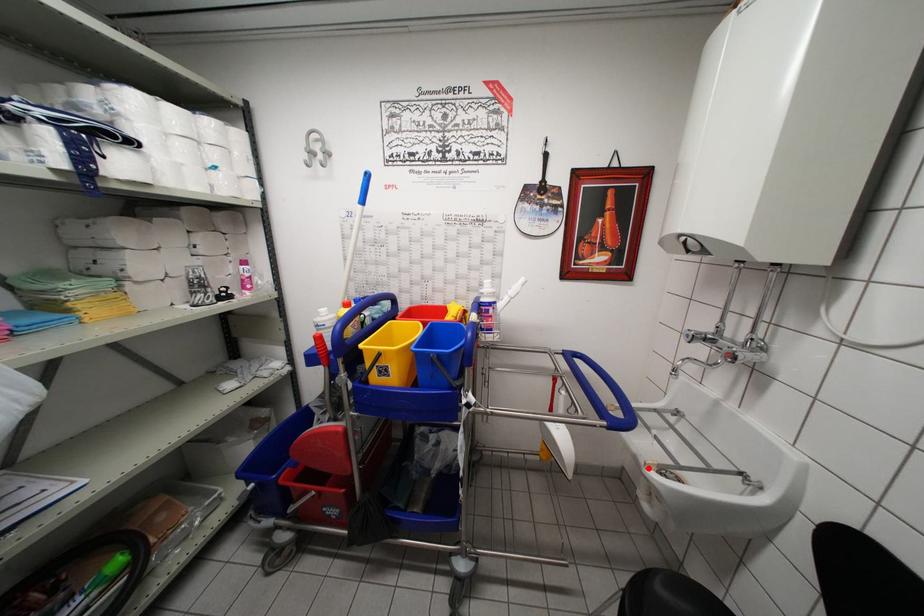
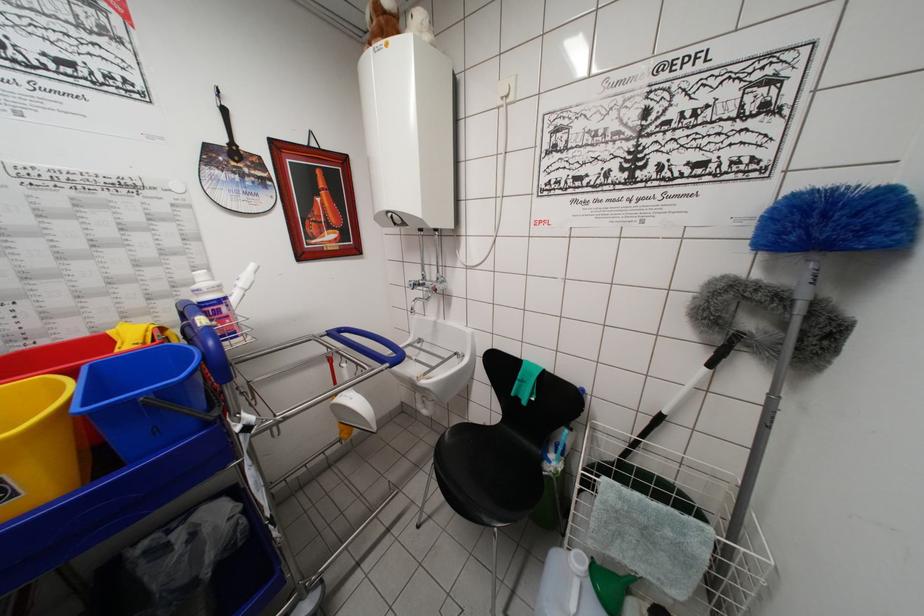
Find the pixel in the second image that matches the highlighted location in the first image.

(420, 383)